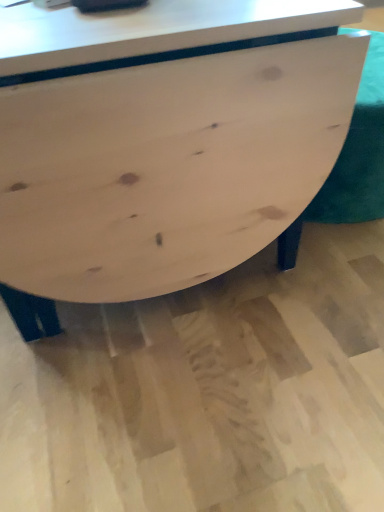
Locate an element on the screen. free spot in front of natural wood table at center is located at coordinates (186, 395).